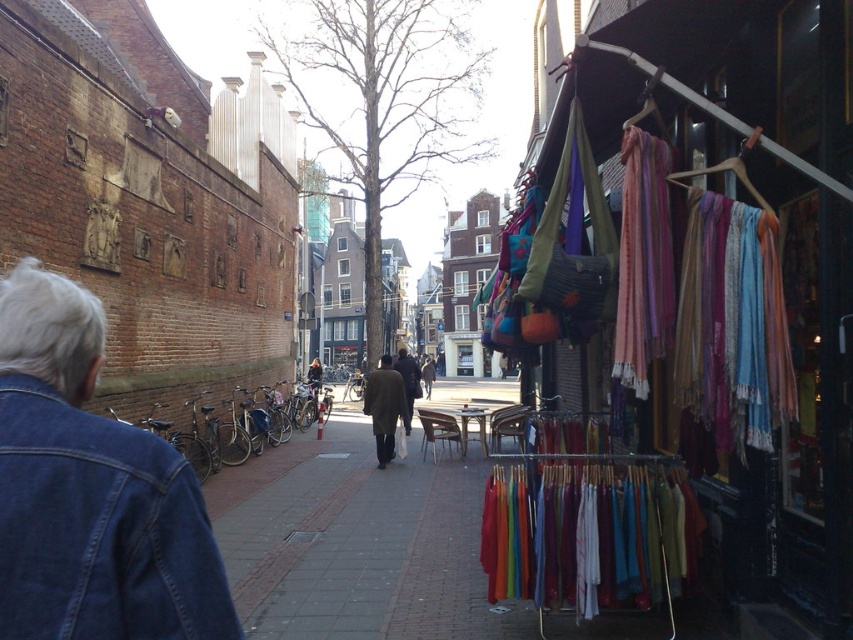
Question: Among these objects, which one is nearest to the camera?

Choices:
 (A) dark brown leather coat at center
 (B) dark brown leather jacket at center
 (C) textured fabric scarves at right

Answer: (C)

Question: Which point is closer to the camera?

Choices:
 (A) dark brown leather jacket at center
 (B) dark brown leather coat at center

Answer: (B)

Question: Can you confirm if denim jacket at left is positioned above dark brown leather coat at center?

Choices:
 (A) no
 (B) yes

Answer: (B)

Question: Which object is positioned closest to the denim jacket at left?

Choices:
 (A) dark brown leather jacket at center
 (B) textured fabric scarves at right

Answer: (B)

Question: Does textured fabric scarves at right appear on the left side of dark brown leather jacket at center?

Choices:
 (A) no
 (B) yes

Answer: (A)

Question: Is denim jacket at left positioned before dark brown wool coat at center?

Choices:
 (A) no
 (B) yes

Answer: (B)